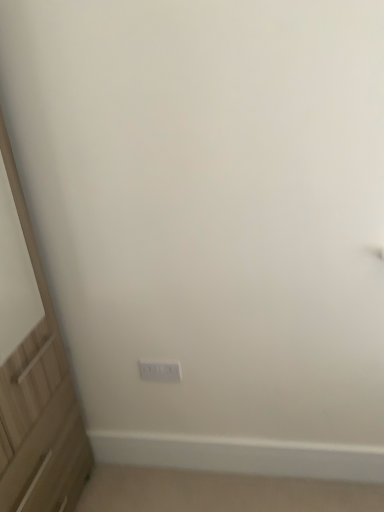
Question: Is white plastic electric outlet at center taller or shorter than light wood screen door at left?

Choices:
 (A) short
 (B) tall

Answer: (A)

Question: From a real-world perspective, is white plastic electric outlet at center above or below light wood screen door at left?

Choices:
 (A) below
 (B) above

Answer: (A)

Question: Would you say white plastic electric outlet at center is inside or outside light wood screen door at left?

Choices:
 (A) outside
 (B) inside

Answer: (A)

Question: Relative to white plastic electric outlet at center, is light wood screen door at left in front or behind?

Choices:
 (A) front
 (B) behind

Answer: (A)

Question: From the image's perspective, is light wood screen door at left positioned above or below white plastic electric outlet at center?

Choices:
 (A) above
 (B) below

Answer: (A)

Question: In terms of width, does light wood screen door at left look wider or thinner when compared to white plastic electric outlet at center?

Choices:
 (A) wide
 (B) thin

Answer: (A)

Question: Does point (6, 222) appear closer or farther from the camera than point (142, 375)?

Choices:
 (A) closer
 (B) farther

Answer: (A)